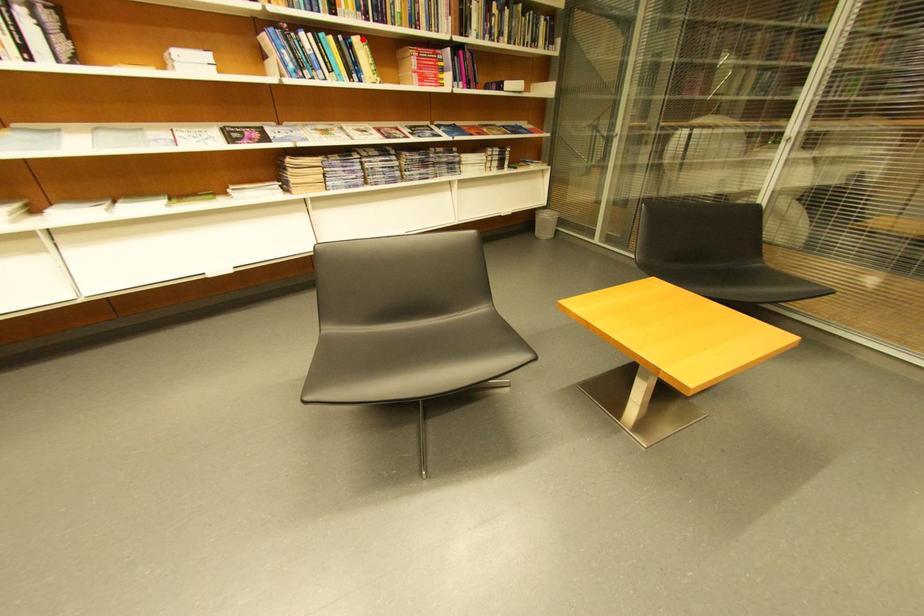
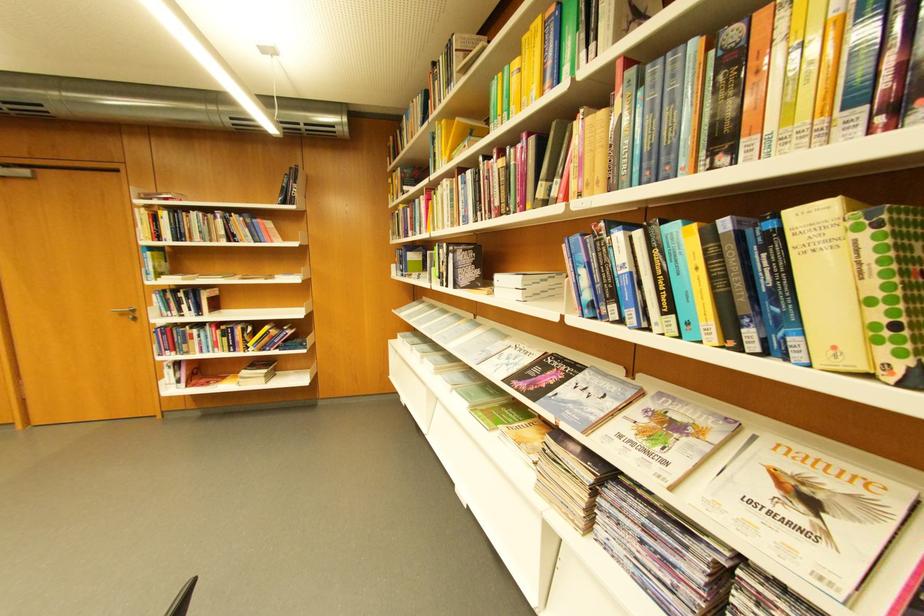
The point at the highlighted location is marked in the first image. Where is the corresponding point in the second image?

(796, 214)